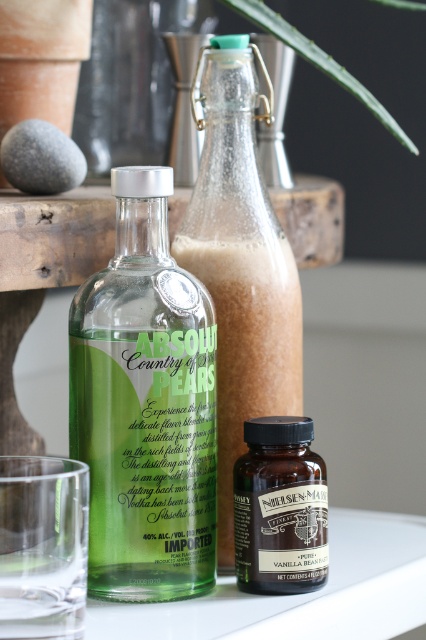
Question: Which of the following is the farthest from the observer?

Choices:
 (A) (284, 636)
 (B) (262, 504)
 (C) (276, 20)
 (D) (276, 403)

Answer: (C)

Question: Among these objects, which one is farthest from the camera?

Choices:
 (A) brown glass bottle at center
 (B) green glass bottle at center
 (C) clear glass at center
 (D) clear glass bottle at center

Answer: (D)

Question: Which point appears closest to the camera in this image?

Choices:
 (A) (256, 566)
 (B) (365, 566)
 (C) (213, 193)
 (D) (371, 112)

Answer: (A)

Question: Can you confirm if clear glass at center is positioned below brown glass bottle at center?

Choices:
 (A) yes
 (B) no

Answer: (A)

Question: Is green glass bottle at center behind green leafy plant at upper center?

Choices:
 (A) no
 (B) yes

Answer: (A)

Question: Does clear glass bottle at center appear over brown glass bottle at center?

Choices:
 (A) no
 (B) yes

Answer: (B)